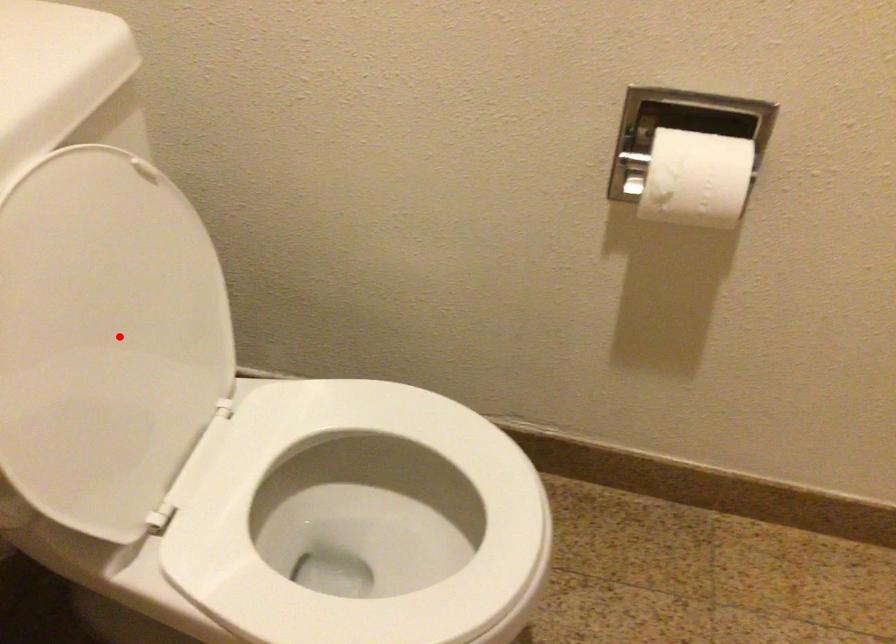
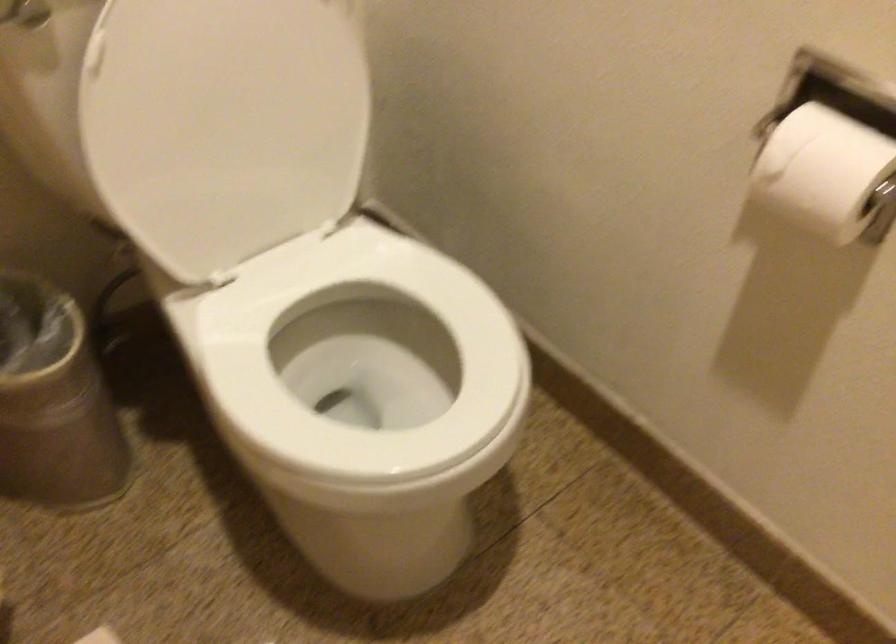
The point at the highlighted location is marked in the first image. Where is the corresponding point in the second image?

(239, 114)